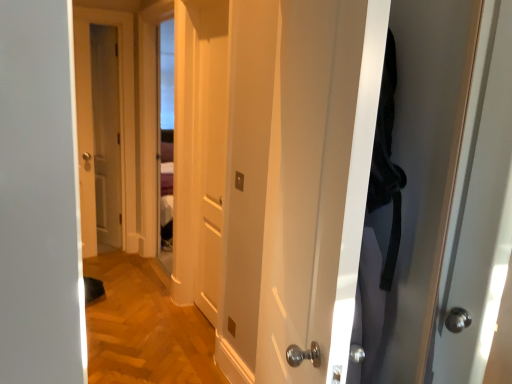
Question: From the image's perspective, is white matte door at center, the second door in the front-to-back sequence, above or below matte wooden door at left, the first door positioned from the back?

Choices:
 (A) below
 (B) above

Answer: (A)

Question: Is white matte door at center, placed as the 2th door when sorted from back to front, wider or thinner than matte wooden door at left, the third door in the front-to-back sequence?

Choices:
 (A) thin
 (B) wide

Answer: (A)

Question: Based on their relative distances, which object is farther from the white glossy door at center, which is counted as the third door, starting from the back?

Choices:
 (A) white matte door at center, the second door in the front-to-back sequence
 (B) matte wooden door at left, marked as the 3th door in a right-to-left arrangement

Answer: (B)

Question: Considering the real-world distances, which object is farthest from the white matte door at center, the second door in the front-to-back sequence?

Choices:
 (A) white glossy door at center, positioned as the 3th door in left-to-right order
 (B) matte wooden door at left, the third door in the front-to-back sequence

Answer: (B)